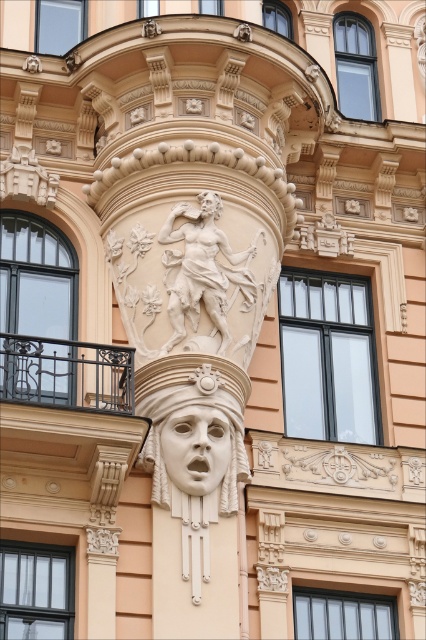
Question: Does white stone mask at center appear under white stone face at center?

Choices:
 (A) no
 (B) yes

Answer: (A)

Question: Which point is closer to the camera?

Choices:
 (A) (164, 467)
 (B) (210, 189)

Answer: (A)

Question: Based on their relative distances, which object is farther from the white stone face at center?

Choices:
 (A) white marble statue at center
 (B) white marble head at center
 (C) white stone mask at center

Answer: (B)

Question: Which point is farther from the camera taking this photo?

Choices:
 (A) (166, 387)
 (B) (195, 422)

Answer: (A)

Question: Can you confirm if white stone face at center is bigger than white marble head at center?

Choices:
 (A) no
 (B) yes

Answer: (B)

Question: Is white marble statue at center to the left of white marble head at center from the viewer's perspective?

Choices:
 (A) no
 (B) yes

Answer: (B)